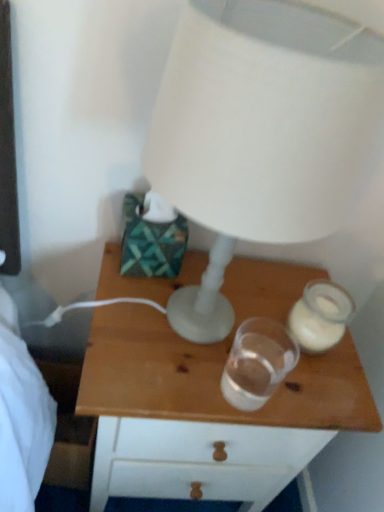
I want to click on vacant area that is situated to the right of white matte lamp at upper center, so click(x=306, y=365).